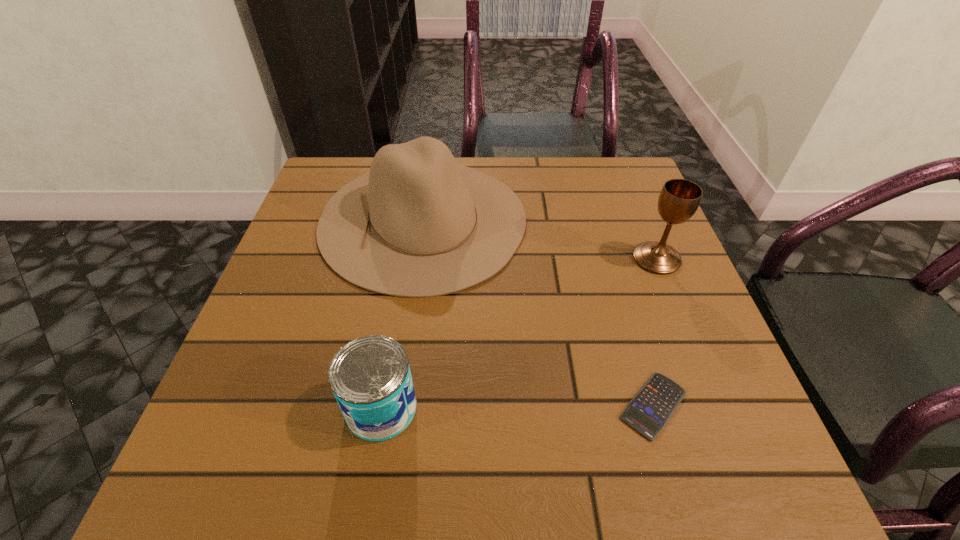
Identify the location of empty location between the calculator and the sombrero. The width and height of the screenshot is (960, 540). 539,313.

Where is `free spot between the can and the sombrero`? This screenshot has width=960, height=540. free spot between the can and the sombrero is located at coordinates (402, 314).

Find the location of a particular element. The height and width of the screenshot is (540, 960). free space that is in between the sombrero and the calculator is located at coordinates (539, 313).

I want to click on vacant region between the shortest object and the third tallest object, so click(x=517, y=407).

In order to click on unoccupied position between the sombrero and the second shortest object in this screenshot , I will do `click(402, 314)`.

Find the location of a particular element. The width and height of the screenshot is (960, 540). vacant space that is in between the chalice and the can is located at coordinates (519, 333).

Locate an element on the screen. vacant space in between the chalice and the sombrero is located at coordinates (540, 239).

You are a GUI agent. You are given a task and a screenshot of the screen. Output one action in this format:
    pyautogui.click(x=<x>, y=<y>)
    Task: Click on the empty location between the can and the sombrero
    
    Given the screenshot: What is the action you would take?
    pyautogui.click(x=402, y=314)

What are the coordinates of `vacant area between the can and the calculator` in the screenshot? It's located at (517, 407).

Identify the location of unoccupied area between the sombrero and the calculator. (539, 313).